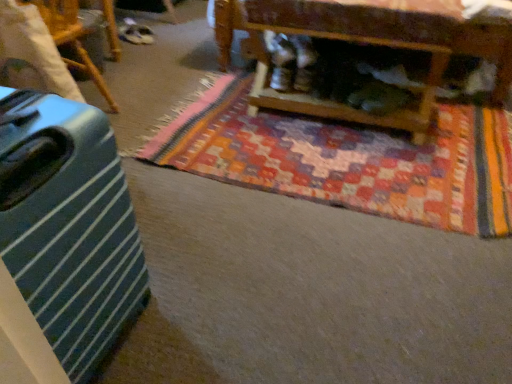
Question: Does green striped suitcase at left, arranged as the second furniture when viewed from the right, appear on the right side of green striped suitcase at left?

Choices:
 (A) yes
 (B) no

Answer: (B)

Question: Is green striped suitcase at left, arranged as the second furniture when viewed from the right, further to the viewer compared to green striped suitcase at left?

Choices:
 (A) no
 (B) yes

Answer: (B)

Question: Is green striped suitcase at left, which appears as the first furniture when viewed from the left, next to green striped suitcase at left and touching it?

Choices:
 (A) no
 (B) yes

Answer: (A)

Question: Is green striped suitcase at left, arranged as the second furniture when viewed from the right, far away from green striped suitcase at left?

Choices:
 (A) yes
 (B) no

Answer: (A)

Question: Is green striped suitcase at left, which appears as the first furniture when viewed from the left, thinner than green striped suitcase at left?

Choices:
 (A) yes
 (B) no

Answer: (A)

Question: Considering the positions of green striped suitcase at left and green striped suitcase at left, which appears as the first furniture when viewed from the left, in the image, is green striped suitcase at left taller or shorter than green striped suitcase at left, which appears as the first furniture when viewed from the left,?

Choices:
 (A) tall
 (B) short

Answer: (A)

Question: From the image's perspective, is green striped suitcase at left above or below green striped suitcase at left, arranged as the second furniture when viewed from the right?

Choices:
 (A) below
 (B) above

Answer: (A)

Question: Looking at the image, does green striped suitcase at left seem bigger or smaller compared to green striped suitcase at left, which appears as the first furniture when viewed from the left?

Choices:
 (A) big
 (B) small

Answer: (A)

Question: Considering the positions of green striped suitcase at left and green striped suitcase at left, which appears as the first furniture when viewed from the left, in the image, is green striped suitcase at left wider or thinner than green striped suitcase at left, which appears as the first furniture when viewed from the left,?

Choices:
 (A) wide
 (B) thin

Answer: (A)

Question: From a real-world perspective, relative to green striped suitcase at left, is multicolored woven mat at center vertically above or below?

Choices:
 (A) below
 (B) above

Answer: (A)

Question: From the image's perspective, relative to green striped suitcase at left, is multicolored woven mat at center above or below?

Choices:
 (A) above
 (B) below

Answer: (A)

Question: Is multicolored woven mat at center spatially inside green striped suitcase at left, or outside of it?

Choices:
 (A) outside
 (B) inside

Answer: (A)

Question: Considering the positions of multicolored woven mat at center and green striped suitcase at left in the image, is multicolored woven mat at center taller or shorter than green striped suitcase at left?

Choices:
 (A) short
 (B) tall

Answer: (A)

Question: Is point (445, 182) closer or farther from the camera than point (117, 105)?

Choices:
 (A) closer
 (B) farther

Answer: (A)

Question: Considering the positions of multicolored woven mat at center and green striped suitcase at left, arranged as the second furniture when viewed from the right, in the image, is multicolored woven mat at center taller or shorter than green striped suitcase at left, arranged as the second furniture when viewed from the right,?

Choices:
 (A) tall
 (B) short

Answer: (B)